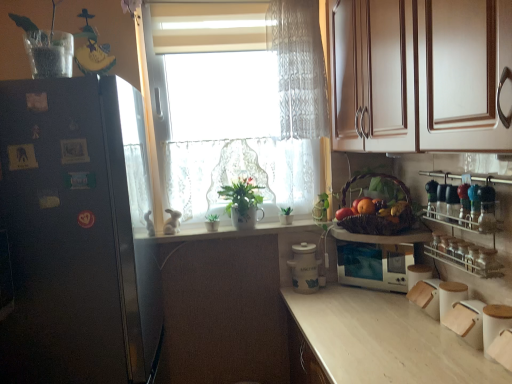
Question: Does point (214, 226) appear closer or farther from the camera than point (290, 223)?

Choices:
 (A) closer
 (B) farther

Answer: (A)

Question: In the image, is green matte houseplant at center, the third houseplant when ordered from right to left, positioned in front of or behind green matte houseplant at center, which is counted as the third houseplant, starting from the left?

Choices:
 (A) front
 (B) behind

Answer: (A)

Question: Considering the real-world distances, which object is closest to the green matte houseplant at center, the 1th houseplant viewed from the right?

Choices:
 (A) clear glass spice rack at right
 (B) smooth yellow potato at lower right, the third fruit positioned from the left
 (C) white ceramic jar at center, marked as the 1th appliance in a left-to-right arrangement
 (D) white glossy microwave at center, the first appliance positioned from the right
 (E) green matte plant pot at center, which appears as the 2th houseplant when viewed from the right

Answer: (E)

Question: Which object is positioned farthest from the black matte refrigerator at left?

Choices:
 (A) white lace curtain at center
 (B) green matte plant pot at center, which appears as the 2th houseplant when viewed from the right
 (C) white ceramic jar at center, marked as the 1th appliance in a left-to-right arrangement
 (D) brown woven basket at right
 (E) white glossy microwave at center, the first appliance positioned from the right

Answer: (E)